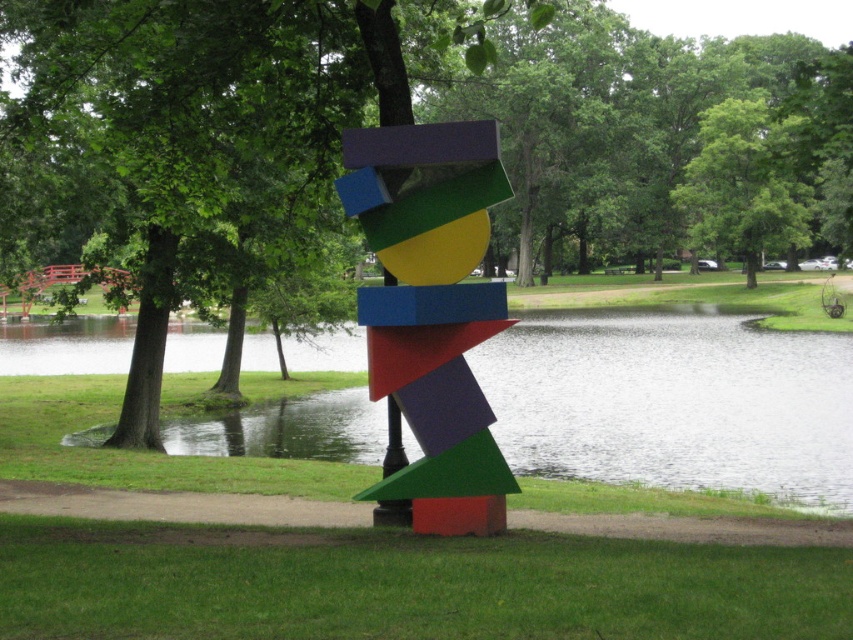
Looking at this image, does green matte tree at center have a larger size compared to green leafy tree at upper center?

Correct, green matte tree at center is larger in size than green leafy tree at upper center.

Is point (206, 104) farther from viewer compared to point (730, 122)?

No, it is not.

The image size is (853, 640). Find the location of `green matte tree at center`. green matte tree at center is located at coordinates (381, 124).

Can you confirm if transparent glass water at center is positioned below multicolored painted blocks at center?

Incorrect, transparent glass water at center is not positioned below multicolored painted blocks at center.

Is transparent glass water at center to the right of multicolored painted blocks at center from the viewer's perspective?

Yes, transparent glass water at center is to the right of multicolored painted blocks at center.

Does point (567, 420) come in front of point (445, 131)?

That is False.

You are a GUI agent. You are given a task and a screenshot of the screen. Output one action in this format:
    pyautogui.click(x=<x>, y=<y>)
    Task: Click on the transparent glass water at center
    This screenshot has height=640, width=853.
    Given the screenshot: What is the action you would take?
    pyautogui.click(x=674, y=401)

Can you confirm if transparent glass water at center is smaller than matte plastic pole at center?

Actually, transparent glass water at center might be larger than matte plastic pole at center.

Is point (364, 339) positioned behind point (386, 108)?

Yes, point (364, 339) is behind point (386, 108).

Identify the location of transparent glass water at center. (674, 401).